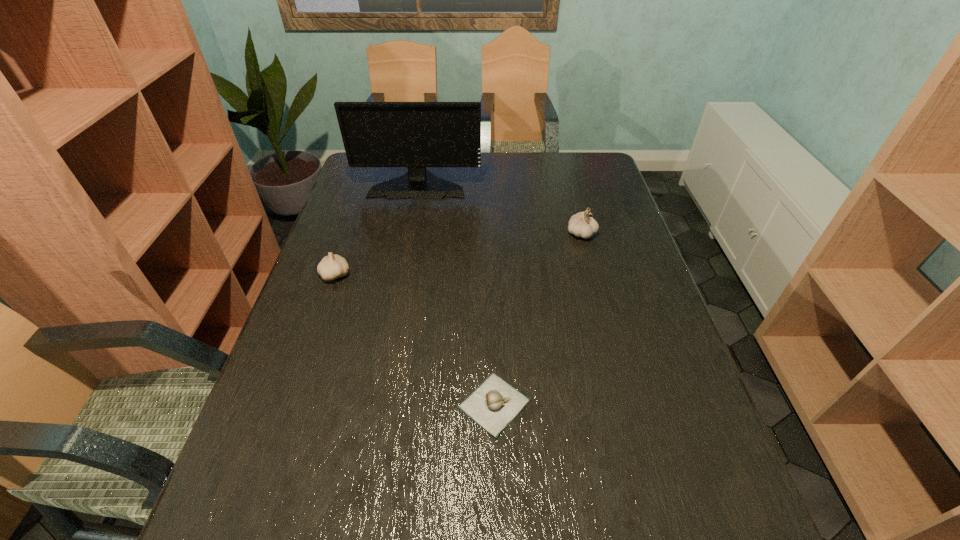
Where is `monitor`? monitor is located at coordinates (416, 135).

You are a GUI agent. You are given a task and a screenshot of the screen. Output one action in this format:
    pyautogui.click(x=<x>, y=<y>)
    Task: Click on the farthest object
    The width and height of the screenshot is (960, 540).
    Given the screenshot: What is the action you would take?
    pyautogui.click(x=416, y=135)

This screenshot has height=540, width=960. In order to click on the rightmost object in this screenshot , I will do point(582,224).

This screenshot has width=960, height=540. I want to click on the second farthest object, so click(582, 224).

Locate an element on the screen. the third tallest object is located at coordinates (333, 266).

You are a GUI agent. You are given a task and a screenshot of the screen. Output one action in this format:
    pyautogui.click(x=<x>, y=<y>)
    Task: Click on the second farthest garlic
    This screenshot has width=960, height=540.
    Given the screenshot: What is the action you would take?
    pyautogui.click(x=333, y=266)

Where is `the nearest garlic`? Image resolution: width=960 pixels, height=540 pixels. the nearest garlic is located at coordinates (493, 405).

I want to click on the second garlic from left to right, so click(493, 405).

Locate an element on the screen. The width and height of the screenshot is (960, 540). vacant space located on the screen side of the tallest object is located at coordinates (405, 255).

Where is `vacant space positioned on the back of the rightmost garlic`? The height and width of the screenshot is (540, 960). vacant space positioned on the back of the rightmost garlic is located at coordinates (562, 160).